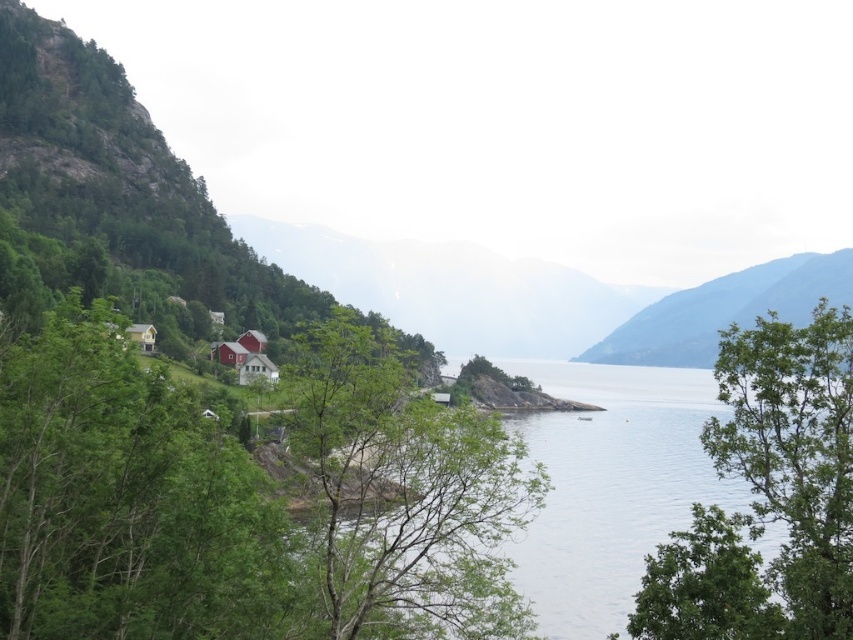
Between green leafy tree at left and clear water at lower left, which one appears on the left side from the viewer's perspective?

green leafy tree at left

Does green leafy tree at left have a lesser height compared to clear water at lower left?

Yes, green leafy tree at left is shorter than clear water at lower left.

Is point (88, 636) farther from camera compared to point (575, 625)?

No, it is not.

Find the location of a particular element. green leafy tree at left is located at coordinates (125, 499).

Is point (39, 435) closer to viewer compared to point (811, 429)?

No, it is behind (811, 429).

What do you see at coordinates (125, 499) in the screenshot? This screenshot has height=640, width=853. I see `green leafy tree at left` at bounding box center [125, 499].

Which is behind, point (73, 397) or point (776, 336)?

The point (73, 397) is behind.

What are the coordinates of `green leafy tree at left` in the screenshot? It's located at (125, 499).

How much distance is there between green leafy tree at center and clear water at lower left?

A distance of 133.59 feet exists between green leafy tree at center and clear water at lower left.

This screenshot has height=640, width=853. What do you see at coordinates (407, 493) in the screenshot?
I see `green leafy tree at center` at bounding box center [407, 493].

Identify the location of green leafy tree at center. (407, 493).

The width and height of the screenshot is (853, 640). I want to click on green leafy tree at center, so click(x=407, y=493).